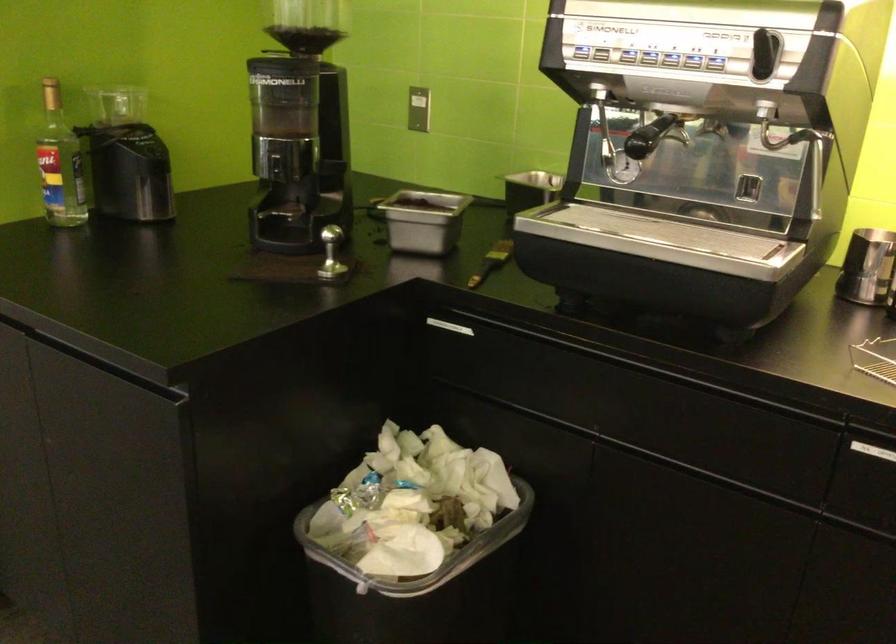
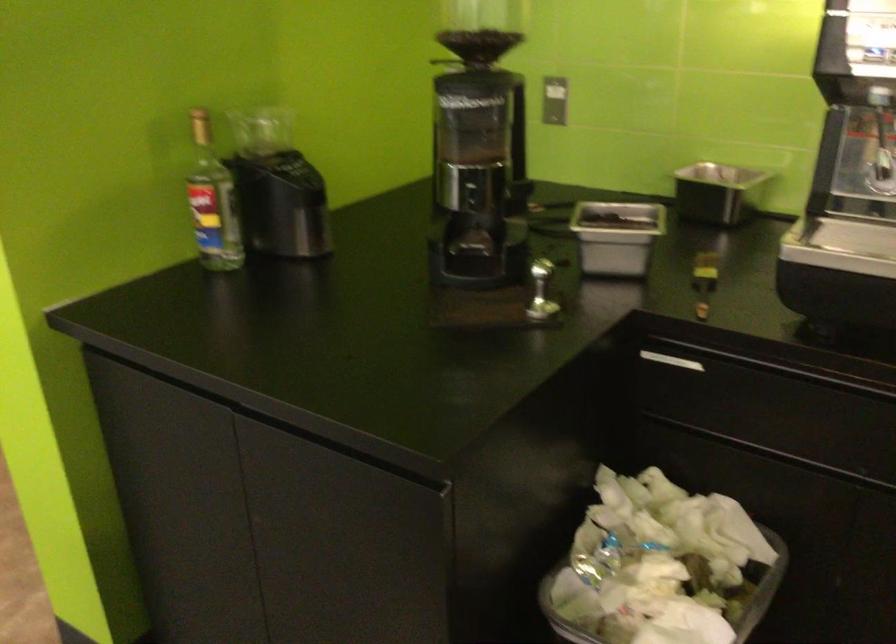
Question: How did the camera likely rotate?

Choices:
 (A) Left
 (B) Right
 (C) Up
 (D) Down

Answer: (D)